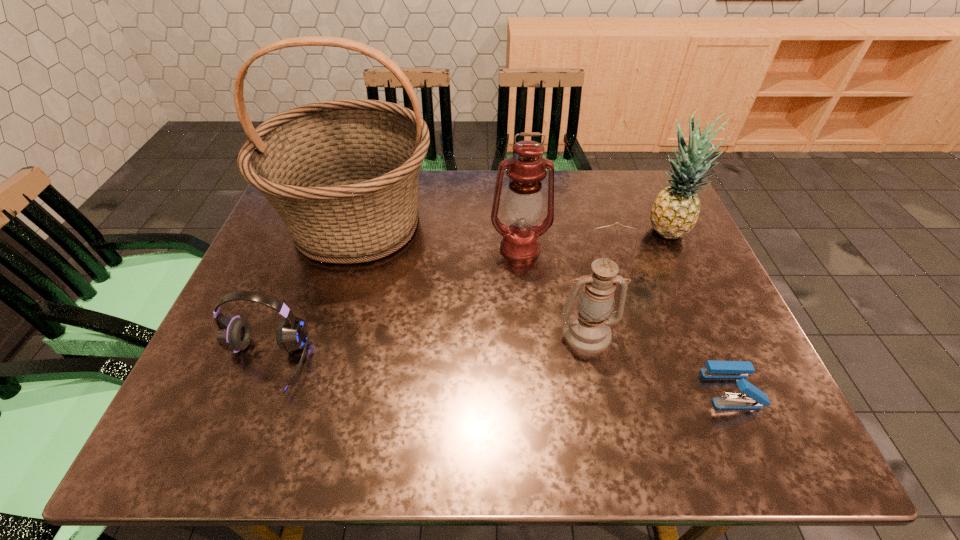
Find the location of a particular element. The width and height of the screenshot is (960, 540). free space at the far right corner of the desktop is located at coordinates (620, 191).

Identify the location of blank space at the near right corner of the desktop. (785, 442).

This screenshot has height=540, width=960. In order to click on free space between the nearer oil lamp and the shortest object in this screenshot , I will do `click(660, 361)`.

I want to click on free space between the basket and the nearer oil lamp, so click(472, 278).

Locate an element on the screen. The height and width of the screenshot is (540, 960). vacant point located between the shortest object and the pineapple is located at coordinates (699, 311).

Identify the location of free area in between the farther oil lamp and the basket. The height and width of the screenshot is (540, 960). (439, 236).

Where is `free space between the stapler and the second shortest object`? Image resolution: width=960 pixels, height=540 pixels. free space between the stapler and the second shortest object is located at coordinates (497, 376).

Where is `free area in between the nearer oil lamp and the tallest object`? free area in between the nearer oil lamp and the tallest object is located at coordinates (472, 278).

I want to click on vacant space that's between the basket and the farther oil lamp, so click(439, 236).

This screenshot has height=540, width=960. I want to click on vacant space that's between the farther oil lamp and the nearer oil lamp, so click(554, 291).